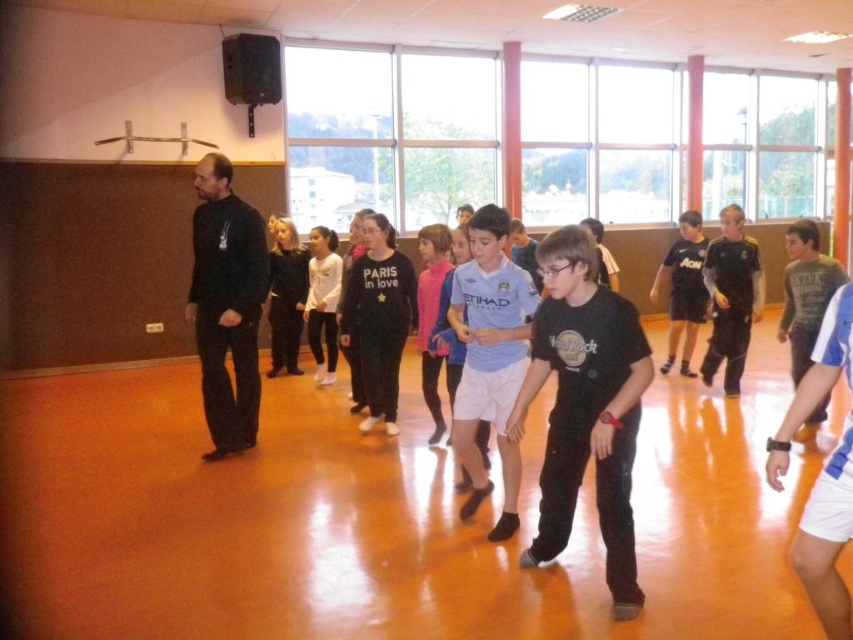
You are a photographer setting up for a group photo in the dance class. You need to position the light blue jersey at center and the white matte shirt at center so that they are side by side. Which clothing item should you place closer to the camera to ensure both appear equally sized in the photo?

The light blue jersey at center has a lesser width compared to the white matte shirt at center. To make them appear equally sized in the photo, place the light blue jersey at center closer to the camera since it is narrower and needs to be magnified slightly to match the size of the white matte shirt at center in the frame.

In the scene shown: You are a photographer setting up for a group photo in the dance class. You need to ensure that the black matte shirt at center and the gray cotton shirt at center are both visible in the frame. Given their heights, which shirt should you focus on to ensure both are fully visible?

The black matte shirt at center is taller than the gray cotton shirt at center, so focusing on the black matte shirt at center will help ensure that both are fully visible in the frame.

In the dance class scene, you notice two shirts at the center of the image. The black matte shirt at center and the gray cotton shirt at center. Which one is positioned to the left?

The black matte shirt at center is to the left of the gray cotton shirt at center.